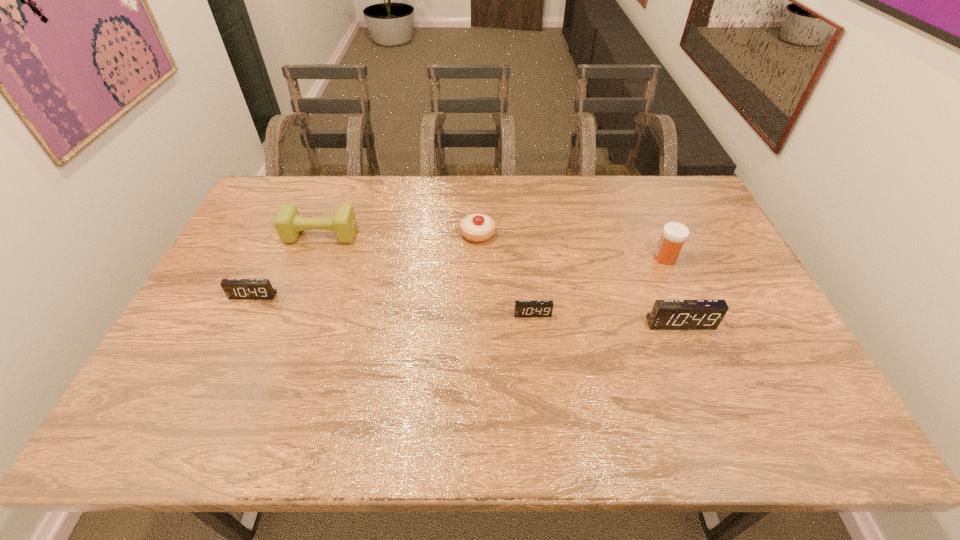
Find the location of `the leftmost alarm clock`. the leftmost alarm clock is located at coordinates (236, 289).

The width and height of the screenshot is (960, 540). Identify the location of the fourth farthest object. click(236, 289).

Locate an element on the screen. The image size is (960, 540). the second alarm clock from left to right is located at coordinates point(523,308).

The height and width of the screenshot is (540, 960). I want to click on the shortest object, so click(523, 308).

Locate an element on the screen. The width and height of the screenshot is (960, 540). the tallest alarm clock is located at coordinates (666, 314).

You are a GUI agent. You are given a task and a screenshot of the screen. Output one action in this format:
    pyautogui.click(x=<x>, y=<y>)
    Task: Click on the third object from left to right
    The width and height of the screenshot is (960, 540).
    Given the screenshot: What is the action you would take?
    pyautogui.click(x=477, y=228)

I want to click on dumbbell, so click(288, 223).

Image resolution: width=960 pixels, height=540 pixels. What are the coordinates of `medicine` in the screenshot? It's located at (674, 234).

The width and height of the screenshot is (960, 540). I want to click on free spot located on the front-facing side of the fifth tallest object, so click(208, 390).

Image resolution: width=960 pixels, height=540 pixels. In order to click on free space located 0.070m on the front-facing side of the shortest object in this screenshot , I will do `click(535, 339)`.